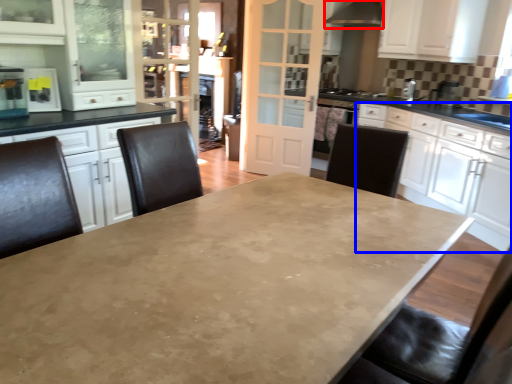
Question: Which point is closer to the camera, exhaust hood (highlighted by a red box) or cabinetry (highlighted by a blue box)?

Choices:
 (A) exhaust hood
 (B) cabinetry

Answer: (B)